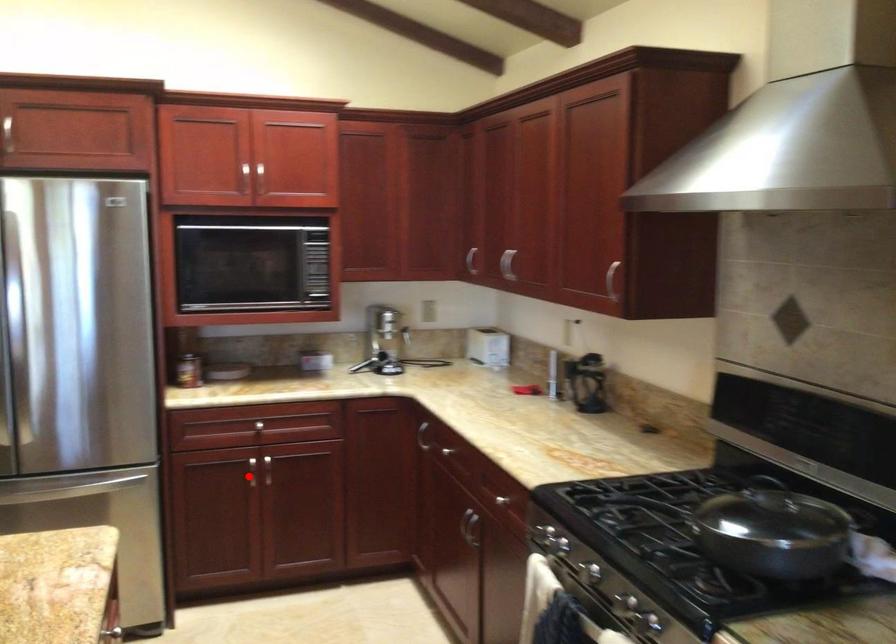
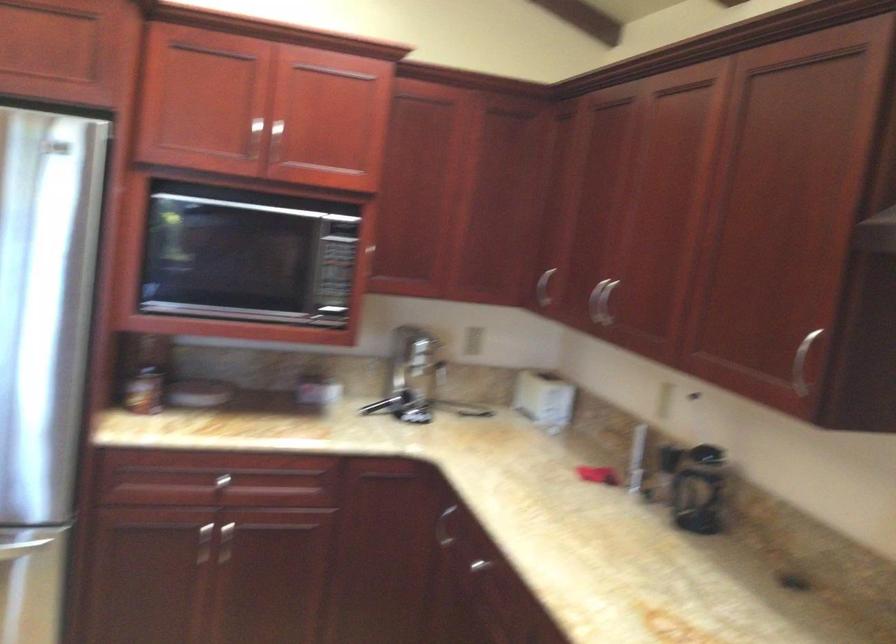
In the second image, find the point that corresponds to the highlighted location in the first image.

(203, 544)